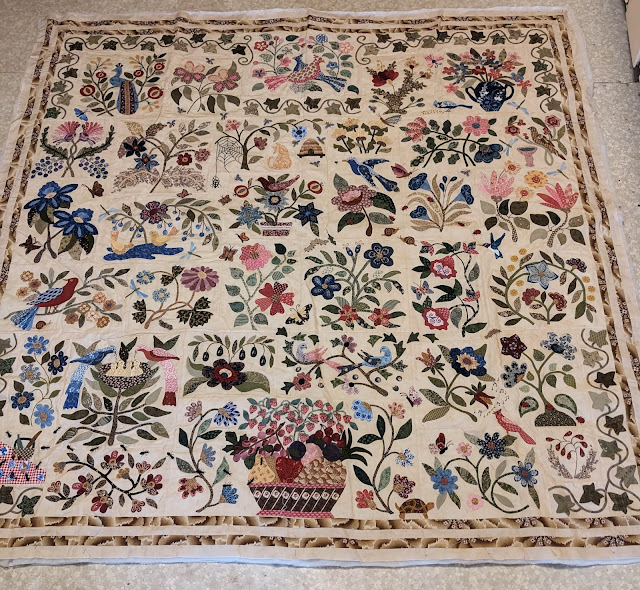
Identify the location of floor. (632, 133).